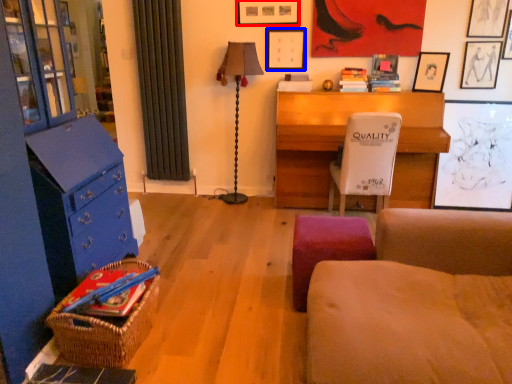
Question: Which object is closer to the camera taking this photo, picture frame (highlighted by a red box) or picture frame (highlighted by a blue box)?

Choices:
 (A) picture frame
 (B) picture frame

Answer: (A)